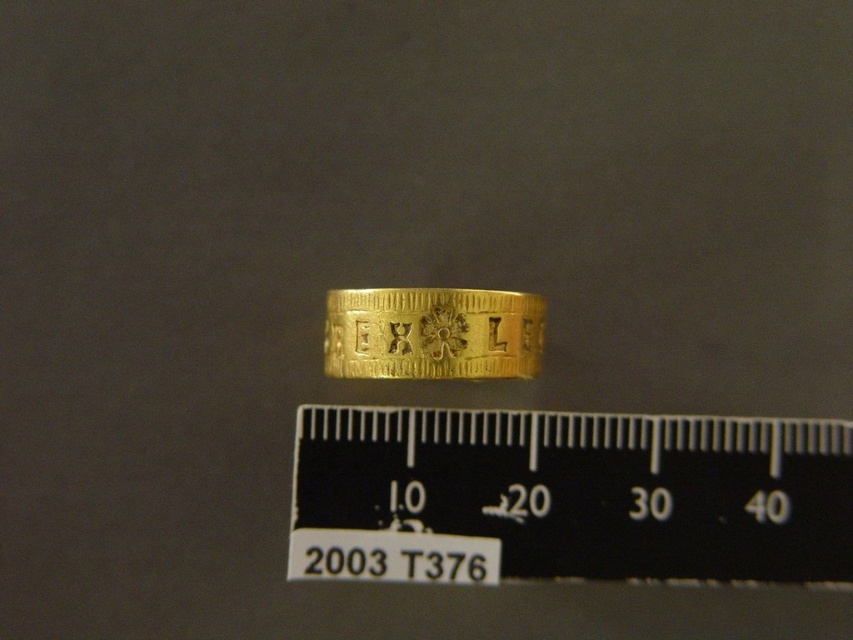
You are a collector examining a goldsmoothring at center and a black plastic ruler at center. Which object is taller?

The black plastic ruler at center is much taller than the goldsmoothring at center.

You are examining the coin and ruler setup. There are two points marked on the image. Can you determine which of the two points, point (795, 461) or point (495, 349), is closer to the camera?

Point (795, 461) is closer to the camera than point (495, 349).